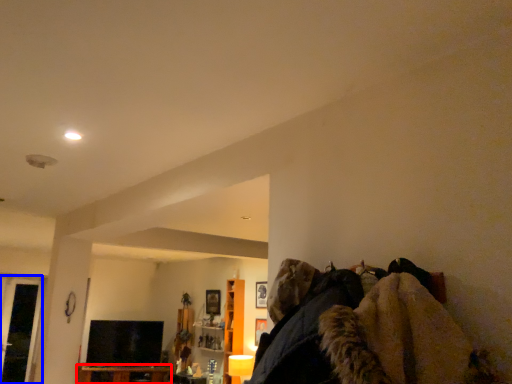
Question: Which object is further to the camera taking this photo, furniture (highlighted by a red box) or glass door (highlighted by a blue box)?

Choices:
 (A) furniture
 (B) glass door

Answer: (A)